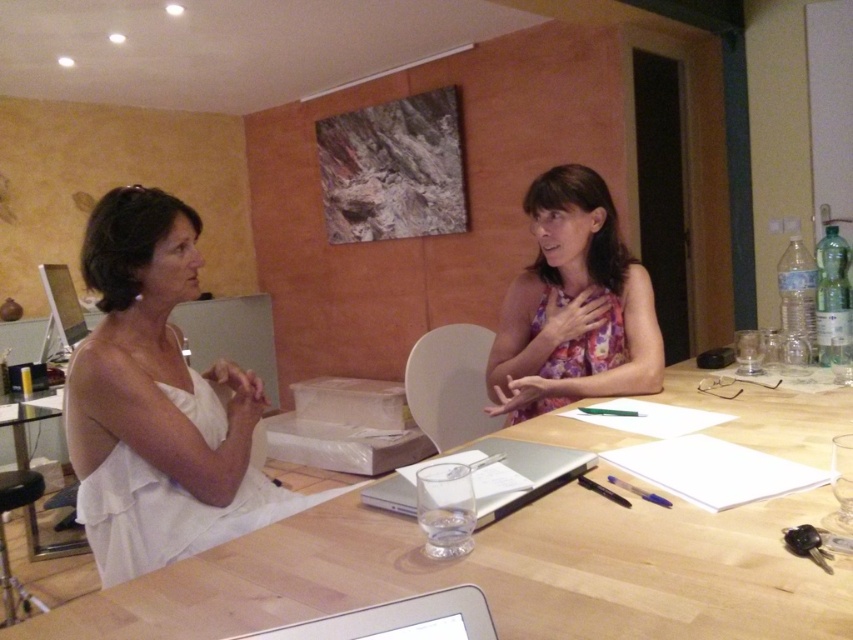
Question: Is wooden table at center to the right of floral fabric dress at center from the viewer's perspective?

Choices:
 (A) no
 (B) yes

Answer: (B)

Question: Which is farther from the wooden table at center?

Choices:
 (A) floral fabric dress at center
 (B) silver metallic laptop at center
 (C) white satin dress at left
 (D) white glossy laptop at center

Answer: (D)

Question: Which of these objects is positioned farthest from the silver metallic laptop at center?

Choices:
 (A) wooden table at center
 (B) floral fabric dress at center

Answer: (B)

Question: Which object appears farthest from the camera in this image?

Choices:
 (A) silver metallic laptop at center
 (B) white glossy laptop at center

Answer: (A)

Question: Considering the relative positions of white glossy laptop at center and silver metallic laptop at center in the image provided, where is white glossy laptop at center located with respect to silver metallic laptop at center?

Choices:
 (A) below
 (B) above

Answer: (B)

Question: In this image, where is white glossy laptop at center located relative to silver metallic laptop at center?

Choices:
 (A) above
 (B) below

Answer: (A)